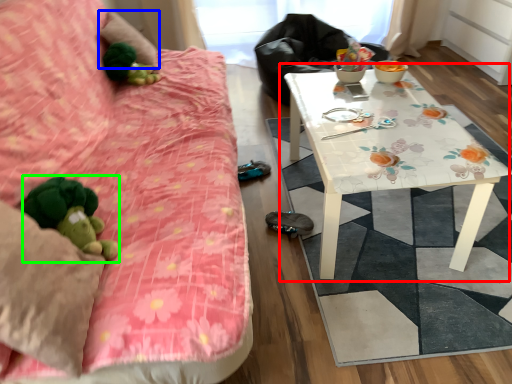
Question: Based on their relative distances, which object is nearer to table (highlighted by a red box)? Choose from pillow (highlighted by a blue box) and toy (highlighted by a green box).

Choices:
 (A) pillow
 (B) toy

Answer: (B)